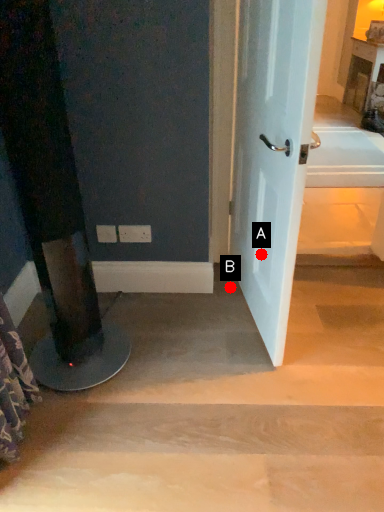
Question: Two points are circled on the image, labeled by A and B beside each circle. Which point is closer to the camera taking this photo?

Choices:
 (A) A is closer
 (B) B is closer

Answer: (A)